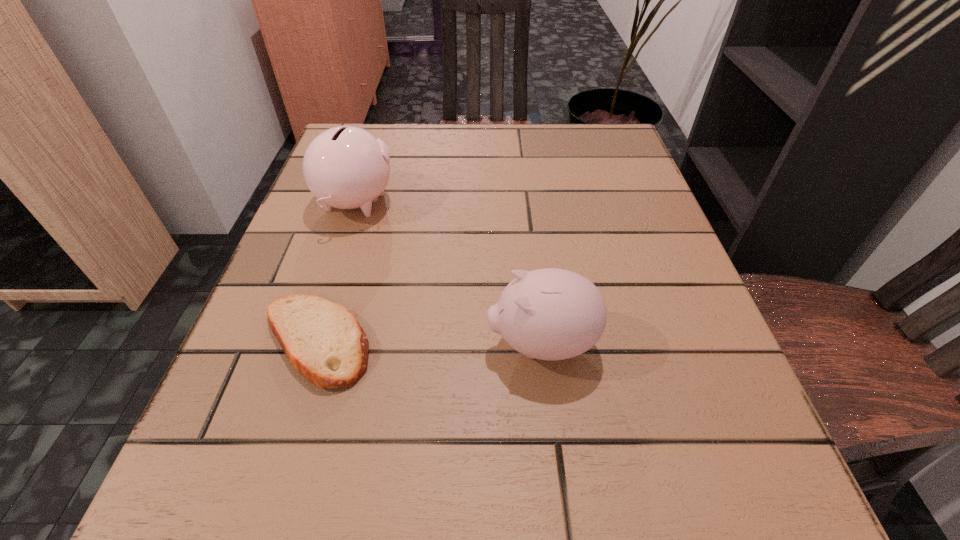
Locate which object ranks second in proximity to the pita bread. Please provide its 2D coordinates. Your answer should be formatted as a tuple, i.e. [(x, y)], where the tuple contains the x and y coordinates of a point satisfying the conditions above.

[(551, 314)]

Identify which object is the second closest to the shortest object. Please provide its 2D coordinates. Your answer should be formatted as a tuple, i.e. [(x, y)], where the tuple contains the x and y coordinates of a point satisfying the conditions above.

[(551, 314)]

You are a GUI agent. You are given a task and a screenshot of the screen. Output one action in this format:
    pyautogui.click(x=<x>, y=<y>)
    Task: Click on the vacant area that satisfies the following two spatial constraints: 1. on the front side of the shortest object; 2. on the left side of the farthest object
    The width and height of the screenshot is (960, 540).
    Given the screenshot: What is the action you would take?
    pyautogui.click(x=311, y=341)